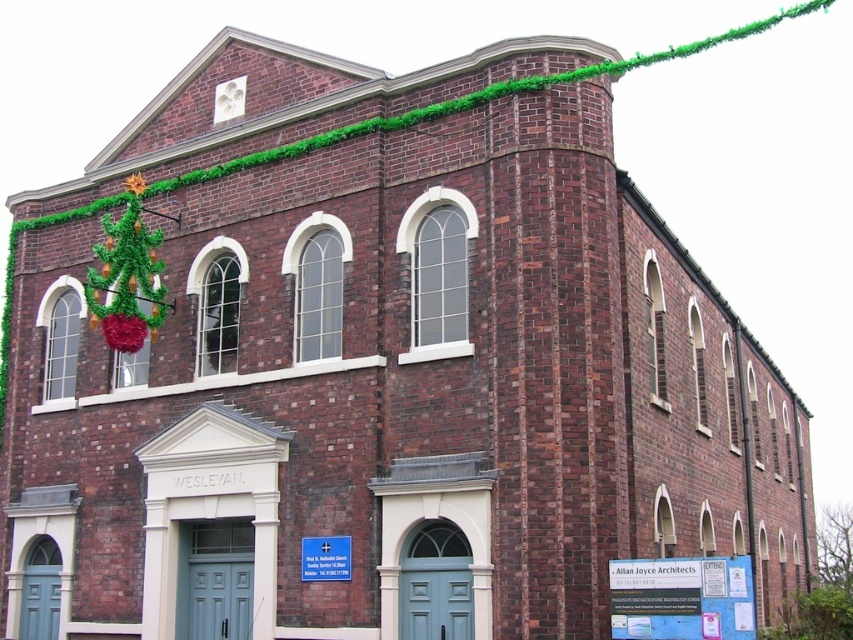
Is green garland at upper center positioned before shiny tinsel christmas tree at left?

Yes.

Who is shorter, green garland at upper center or shiny tinsel christmas tree at left?

Standing shorter between the two is shiny tinsel christmas tree at left.

This screenshot has width=853, height=640. Find the location of `green garland at upper center`. green garland at upper center is located at coordinates (490, 97).